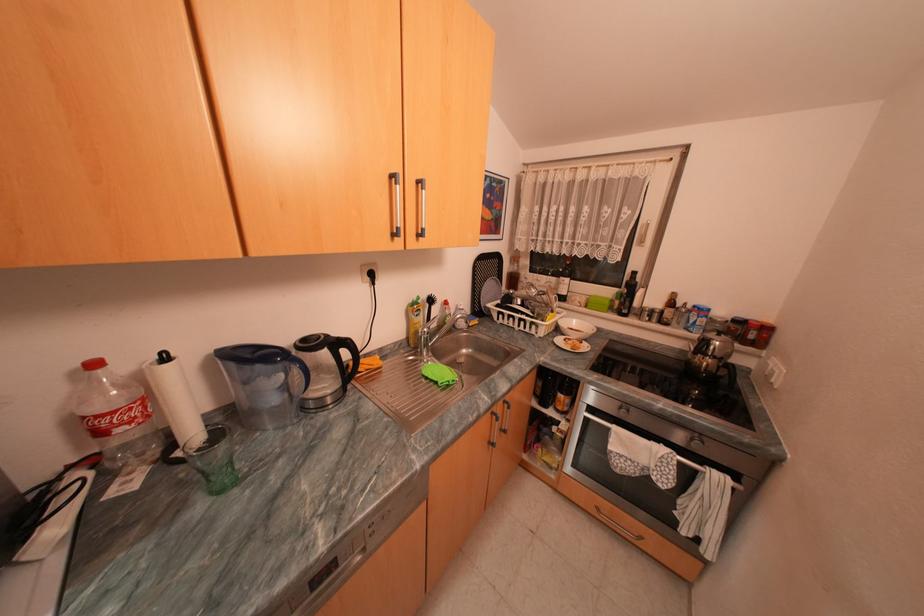
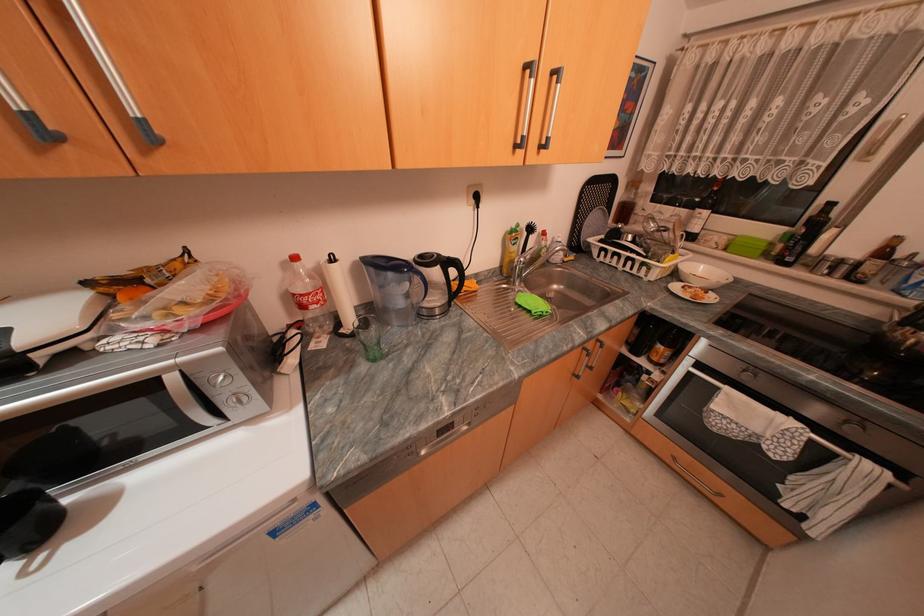
In the second image, find the point that corresponds to (x=221, y=492) in the first image.

(378, 359)